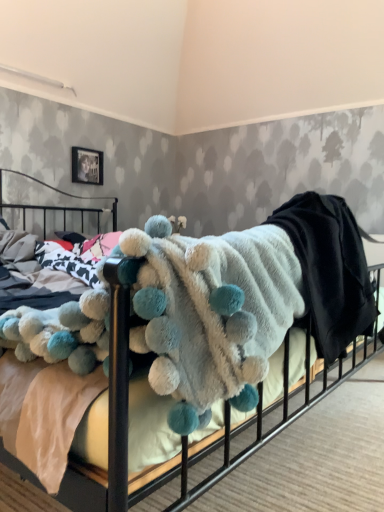
Question: From the image's perspective, is fluffy white blanket with blue pom-poms at center over metallic silver picture frame at upper left?

Choices:
 (A) yes
 (B) no

Answer: (B)

Question: Is fluffy white blanket with blue pom-poms at center with metallic silver picture frame at upper left?

Choices:
 (A) no
 (B) yes

Answer: (A)

Question: Is fluffy white blanket with blue pom-poms at center oriented away from metallic silver picture frame at upper left?

Choices:
 (A) no
 (B) yes

Answer: (A)

Question: Can you confirm if fluffy white blanket with blue pom-poms at center is smaller than metallic silver picture frame at upper left?

Choices:
 (A) yes
 (B) no

Answer: (B)

Question: From a real-world perspective, does fluffy white blanket with blue pom-poms at center stand above metallic silver picture frame at upper left?

Choices:
 (A) yes
 (B) no

Answer: (B)

Question: Relative to metallic silver picture frame at upper left, is fluffy white blanket with blue pom-poms at center in front or behind?

Choices:
 (A) behind
 (B) front

Answer: (B)

Question: From the image's perspective, is fluffy white blanket with blue pom-poms at center positioned above or below metallic silver picture frame at upper left?

Choices:
 (A) below
 (B) above

Answer: (A)

Question: Is fluffy white blanket with blue pom-poms at center wider or thinner than metallic silver picture frame at upper left?

Choices:
 (A) thin
 (B) wide

Answer: (B)

Question: Based on their sizes in the image, would you say fluffy white blanket with blue pom-poms at center is bigger or smaller than metallic silver picture frame at upper left?

Choices:
 (A) big
 (B) small

Answer: (A)

Question: Is fluffy white blanket at center wider or thinner than metallic silver picture frame at upper left?

Choices:
 (A) thin
 (B) wide

Answer: (B)

Question: Is fluffy white blanket at center in front of or behind metallic silver picture frame at upper left in the image?

Choices:
 (A) behind
 (B) front

Answer: (B)

Question: Considering the positions of fluffy white blanket at center and metallic silver picture frame at upper left in the image, is fluffy white blanket at center bigger or smaller than metallic silver picture frame at upper left?

Choices:
 (A) small
 (B) big

Answer: (B)

Question: In terms of height, does fluffy white blanket at center look taller or shorter compared to metallic silver picture frame at upper left?

Choices:
 (A) short
 (B) tall

Answer: (B)

Question: In the image, is metallic silver picture frame at upper left on the left side or the right side of fluffy white blanket with blue pom-poms at center?

Choices:
 (A) right
 (B) left

Answer: (B)

Question: From the image's perspective, relative to fluffy white blanket with blue pom-poms at center, is metallic silver picture frame at upper left above or below?

Choices:
 (A) above
 (B) below

Answer: (A)